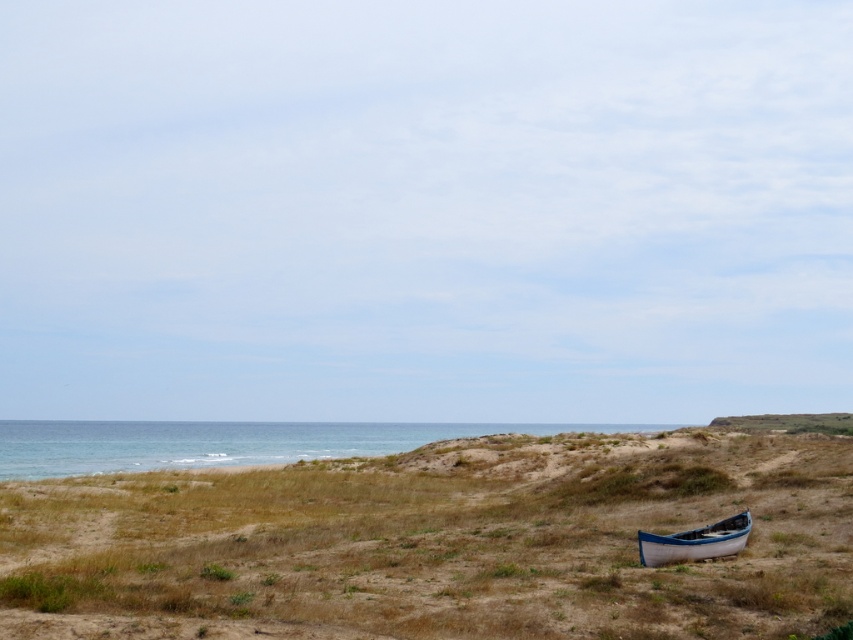
The width and height of the screenshot is (853, 640). Describe the element at coordinates (440, 541) in the screenshot. I see `brown grassy hillside at lower right` at that location.

Is brown grassy hillside at lower right wider than blue water at lower left?

No.

Locate an element on the screen. This screenshot has width=853, height=640. brown grassy hillside at lower right is located at coordinates click(x=440, y=541).

Who is more forward, [3,624] or [735,536]?

Point [3,624] is in front.

The image size is (853, 640). What are the coordinates of `brown grassy hillside at lower right` in the screenshot? It's located at (440, 541).

Can you confirm if blue water at lower left is positioned below white canvas canoe at lower right?

Correct, blue water at lower left is located below white canvas canoe at lower right.

Between point (405, 444) and point (697, 536), which one is positioned in front?

Positioned in front is point (697, 536).

Describe the element at coordinates (227, 442) in the screenshot. I see `blue water at lower left` at that location.

Locate an element on the screen. blue water at lower left is located at coordinates (227, 442).